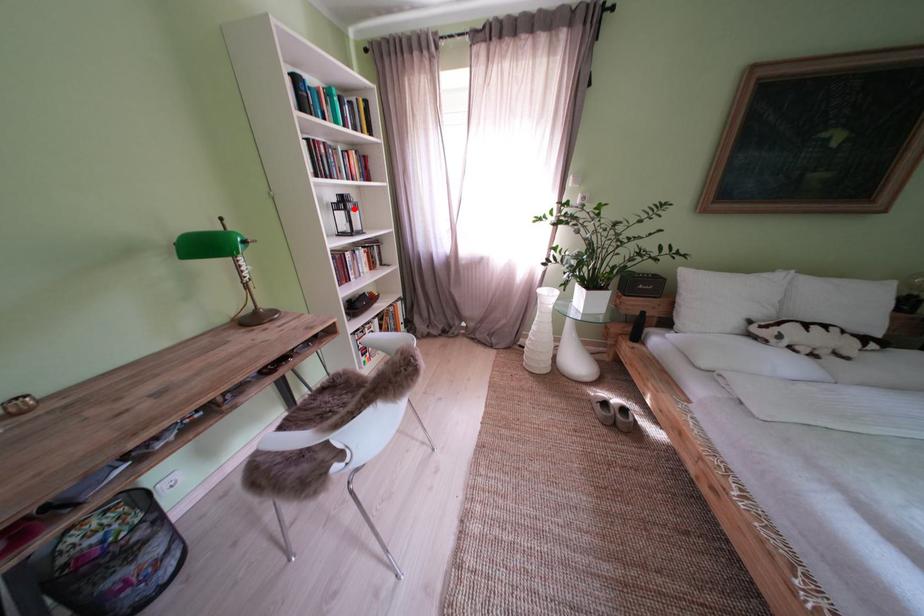
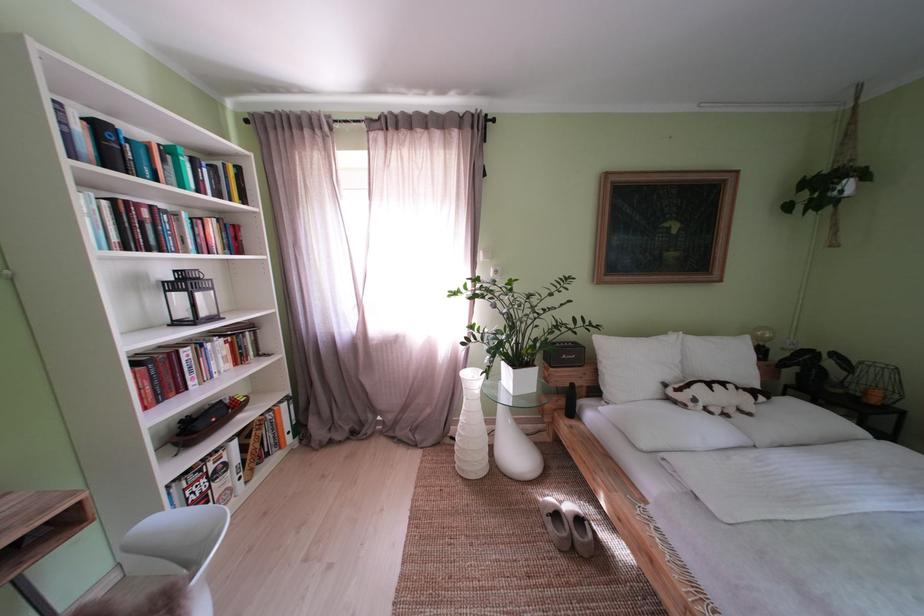
Question: I am providing you with two images of the same scene from different viewpoints. A red point is shown in image1. For the corresponding object point in image2, is it positioned nearer or farther from the camera?

Choices:
 (A) Nearer
 (B) Farther

Answer: (B)